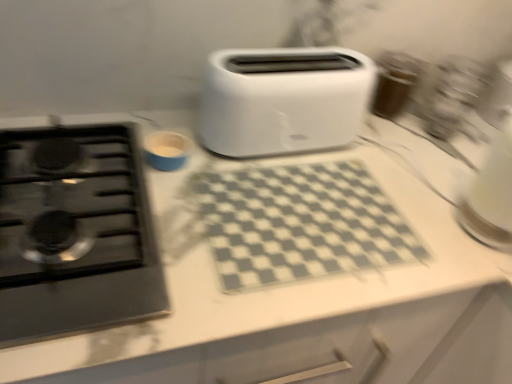
The image size is (512, 384). What do you see at coordinates (75, 233) in the screenshot?
I see `black glass gas stove at left` at bounding box center [75, 233].

Where is `black glass gas stove at left`? The width and height of the screenshot is (512, 384). black glass gas stove at left is located at coordinates (75, 233).

Locate an element on the screen. Image resolution: width=512 pixels, height=384 pixels. white plastic toaster at center is located at coordinates (284, 100).

This screenshot has height=384, width=512. What do you see at coordinates (284, 100) in the screenshot? I see `white plastic toaster at center` at bounding box center [284, 100].

You are a GUI agent. You are given a task and a screenshot of the screen. Output one action in this format:
    pyautogui.click(x=<x>, y=<y>)
    Task: Click on the black glass gas stove at left
    The width and height of the screenshot is (512, 384).
    Given the screenshot: What is the action you would take?
    pyautogui.click(x=75, y=233)

Considering the positions of objects black glass gas stove at left and white plastic toaster at center in the image provided, who is more to the left, black glass gas stove at left or white plastic toaster at center?

From the viewer's perspective, black glass gas stove at left appears more on the left side.

Between black glass gas stove at left and white plastic toaster at center, which one is positioned behind?

white plastic toaster at center is more distant.

Considering the positions of points (100, 297) and (321, 73), is point (100, 297) farther from camera compared to point (321, 73)?

No.

From the image's perspective, does black glass gas stove at left appear higher than white plastic toaster at center?

Incorrect, from the image's perspective, black glass gas stove at left is lower than white plastic toaster at center.

From a real-world perspective, is black glass gas stove at left above or below white plastic toaster at center?

Clearly, from a real-world perspective, black glass gas stove at left is below white plastic toaster at center.

Looking at their sizes, would you say black glass gas stove at left is wider or thinner than white plastic toaster at center?

black glass gas stove at left is wider than white plastic toaster at center.

Is black glass gas stove at left shorter than white plastic toaster at center?

Yes, black glass gas stove at left is shorter than white plastic toaster at center.

Is black glass gas stove at left bigger or smaller than white plastic toaster at center?

Considering their sizes, black glass gas stove at left takes up less space than white plastic toaster at center.

Is white plastic toaster at center completely or partially inside black glass gas stove at left?

That's incorrect, white plastic toaster at center is not inside black glass gas stove at left.

Is black glass gas stove at left far away from white plastic toaster at center?

No, black glass gas stove at left is in close proximity to white plastic toaster at center.

Is black glass gas stove at left looking in the opposite direction of white plastic toaster at center?

No.

How distant is black glass gas stove at left from white plastic toaster at center?

black glass gas stove at left and white plastic toaster at center are 13.36 inches apart.

The image size is (512, 384). What are the coordinates of `toaster above the black glass gas stove at left (from a real-world perspective)` in the screenshot? It's located at (284, 100).

Which is more to the right, white plastic toaster at center or black glass gas stove at left?

white plastic toaster at center is more to the right.

Which object is closer to the camera taking this photo, white plastic toaster at center or black glass gas stove at left?

black glass gas stove at left is in front.

Is point (278, 141) closer to viewer compared to point (91, 144)?

No, it is behind (91, 144).

From the image's perspective, which is above, white plastic toaster at center or black glass gas stove at left?

white plastic toaster at center is shown above in the image.

From a real-world perspective, relative to black glass gas stove at left, is white plastic toaster at center vertically above or below?

white plastic toaster at center is above black glass gas stove at left.

Between white plastic toaster at center and black glass gas stove at left, which one has smaller width?

With smaller width is white plastic toaster at center.

Is white plastic toaster at center taller or shorter than black glass gas stove at left?

In the image, white plastic toaster at center appears to be taller than black glass gas stove at left.

Who is bigger, white plastic toaster at center or black glass gas stove at left?

white plastic toaster at center is bigger.

Would you say black glass gas stove at left is part of white plastic toaster at center's contents?

No, black glass gas stove at left is not surrounded by white plastic toaster at center.

Is the surface of white plastic toaster at center in direct contact with black glass gas stove at left?

No, white plastic toaster at center is not with black glass gas stove at left.

Could you tell me if white plastic toaster at center is facing black glass gas stove at left?

No.

Can you tell me how much white plastic toaster at center and black glass gas stove at left differ in facing direction?

They differ by 0.0961 degrees in their facing directions.

You are a GUI agent. You are given a task and a screenshot of the screen. Output one action in this format:
    pyautogui.click(x=<x>, y=<y>)
    Task: Click on the toaster that is above the black glass gas stove at left (from a real-world perspective)
    This screenshot has height=384, width=512.
    Given the screenshot: What is the action you would take?
    pyautogui.click(x=284, y=100)

I want to click on gas stove to the left of white plastic toaster at center, so click(x=75, y=233).

You are a GUI agent. You are given a task and a screenshot of the screen. Output one action in this format:
    pyautogui.click(x=<x>, y=<y>)
    Task: Click on the gas stove that is below the white plastic toaster at center (from the image's perspective)
    
    Given the screenshot: What is the action you would take?
    pyautogui.click(x=75, y=233)